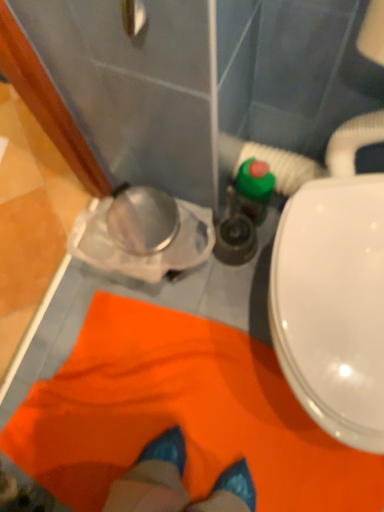
Where is `orange fabric at lower center`? Image resolution: width=384 pixels, height=512 pixels. orange fabric at lower center is located at coordinates (180, 415).

The width and height of the screenshot is (384, 512). Describe the element at coordinates (180, 415) in the screenshot. I see `orange fabric at lower center` at that location.

What is the approximate width of orange fabric at lower center?

31.36 inches.

You are a GUI agent. You are given a task and a screenshot of the screen. Output one action in this format:
    pyautogui.click(x=<x>, y=<y>)
    Task: Click on the orange fabric at lower center
    This screenshot has width=384, height=512.
    Given the screenshot: What is the action you would take?
    pyautogui.click(x=180, y=415)